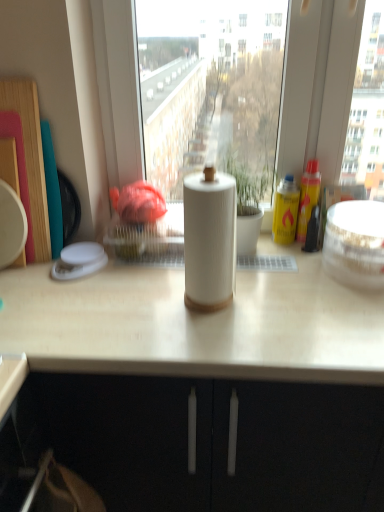
Where is `free space to the left of white matte paper towel at center`? This screenshot has height=512, width=384. free space to the left of white matte paper towel at center is located at coordinates (127, 309).